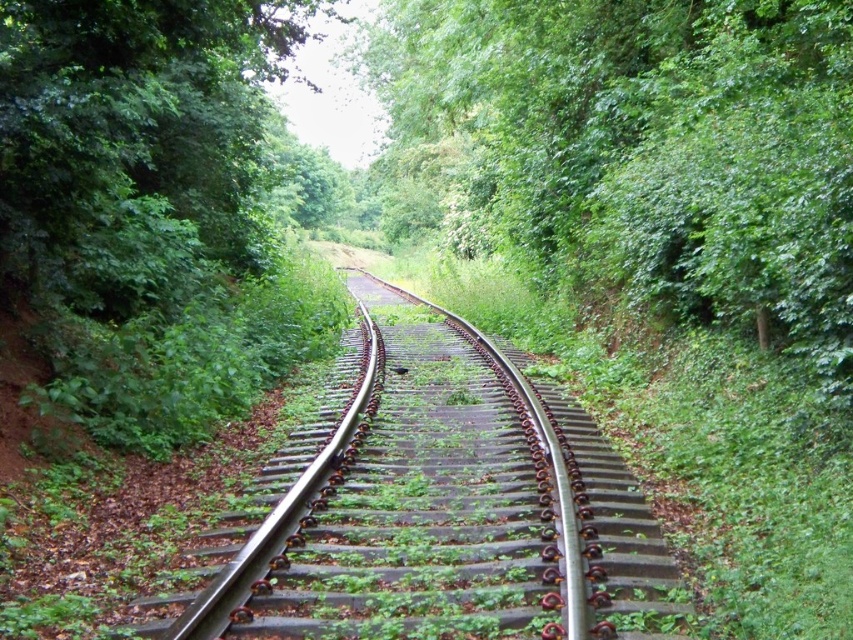
Question: Can you confirm if green leafy tree at center is bigger than metal/smooth track at center?

Choices:
 (A) no
 (B) yes

Answer: (B)

Question: Is green leafy tree at center closer to camera compared to metal/smooth track at center?

Choices:
 (A) yes
 (B) no

Answer: (B)

Question: Is green leafy tree at center below metal/smooth track at center?

Choices:
 (A) yes
 (B) no

Answer: (B)

Question: Among these objects, which one is farthest from the camera?

Choices:
 (A) metal/smooth track at center
 (B) green leafy tree at center

Answer: (B)

Question: Which point is closer to the camera taking this photo?

Choices:
 (A) (380, 397)
 (B) (704, 88)

Answer: (B)

Question: Among these points, which one is nearest to the camera?

Choices:
 (A) (769, 296)
 (B) (508, 596)

Answer: (B)